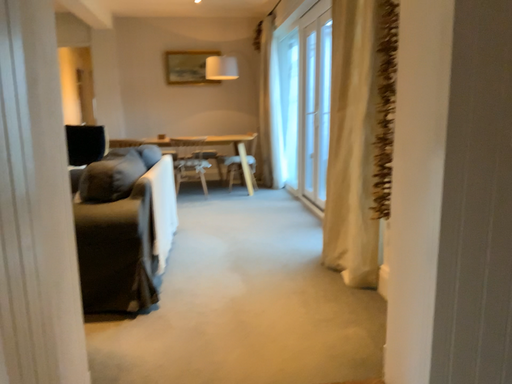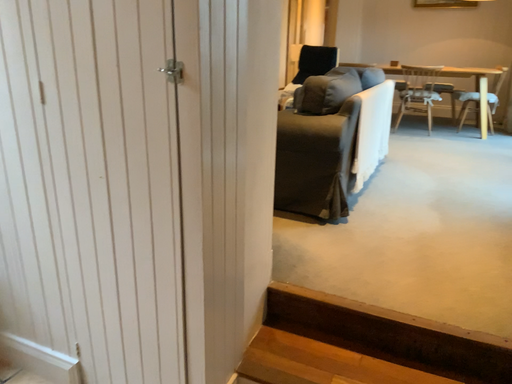
Question: How did the camera likely rotate when shooting the video?

Choices:
 (A) rotated downward
 (B) rotated upward

Answer: (A)